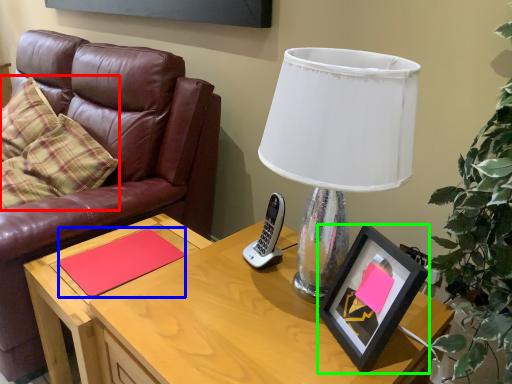
Question: Which is nearer to the pillow (highlighted by a red box)? notepad (highlighted by a blue box) or picture frame (highlighted by a green box).

Choices:
 (A) notepad
 (B) picture frame

Answer: (A)